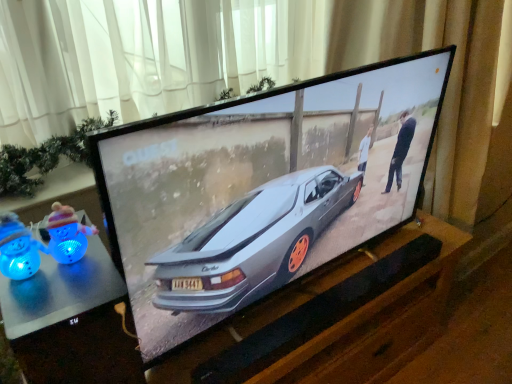
Question: From the image's perspective, relative to white sheer curtain at upper center, is blue plastic toy at left, the first toy from the right, above or below?

Choices:
 (A) below
 (B) above

Answer: (A)

Question: From a real-world perspective, is blue plastic toy at left, positioned as the 2th toy in left-to-right order, positioned above or below white sheer curtain at upper center?

Choices:
 (A) above
 (B) below

Answer: (B)

Question: Estimate the real-world distances between objects in this image. Which object is closer to the metallic silver table at lower left?

Choices:
 (A) blue plastic toy at lower left, which is counted as the second toy, starting from the right
 (B) blue plastic toy at left, positioned as the 2th toy in left-to-right order
 (C) satin silver car at center
 (D) white sheer curtain at upper center

Answer: (B)

Question: Which object is positioned farthest from the metallic silver table at lower left?

Choices:
 (A) satin silver car at center
 (B) blue plastic toy at left, positioned as the 2th toy in left-to-right order
 (C) blue plastic toy at lower left, which is counted as the second toy, starting from the right
 (D) white sheer curtain at upper center

Answer: (D)